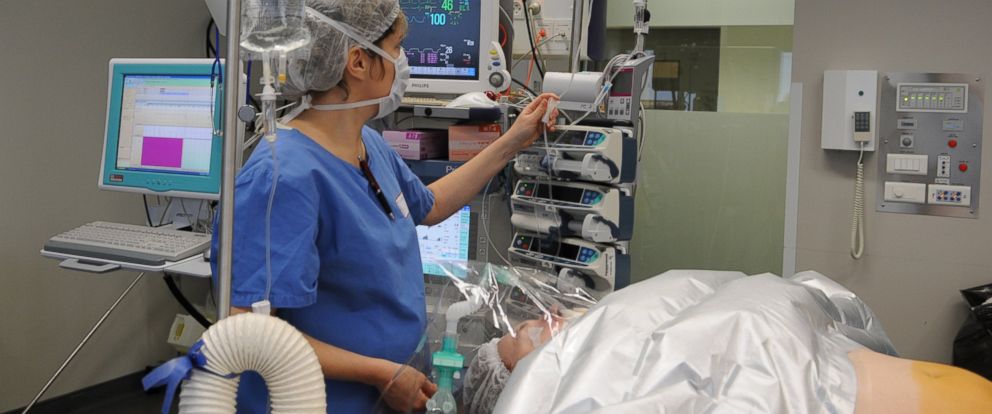
Identify the location of phone. The height and width of the screenshot is (414, 992). (851, 86).